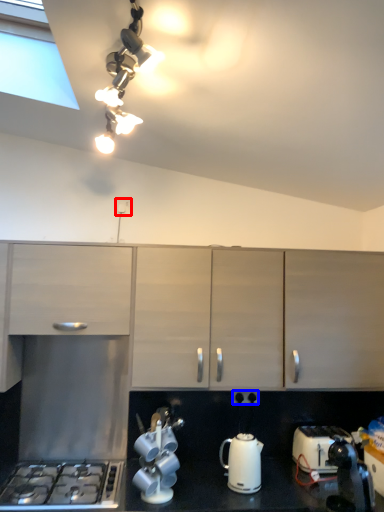
Question: Among these objects, which one is farthest to the camera, electric outlet (highlighted by a red box) or electric outlet (highlighted by a blue box)?

Choices:
 (A) electric outlet
 (B) electric outlet

Answer: (A)